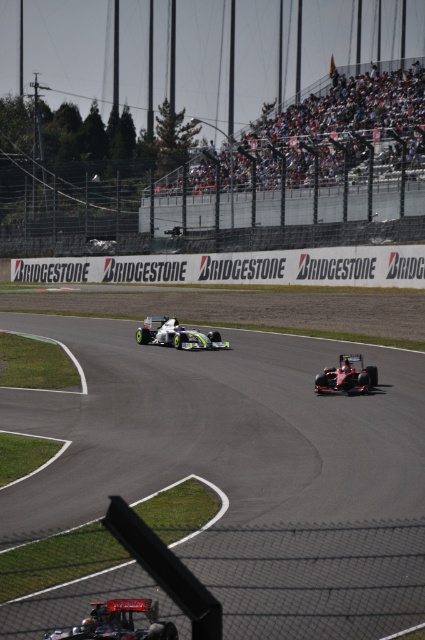
Looking at this image, which is more to the left, black rubber tire at lower center or black rubber tire at center?

black rubber tire at center is more to the left.

Is black rubber tire at lower center positioned in front of black rubber tire at center?

That is True.

Does point (374, 376) come farther from viewer compared to point (178, 336)?

No.

You are a GUI agent. You are given a task and a screenshot of the screen. Output one action in this format:
    pyautogui.click(x=<x>, y=<y>)
    Task: Click on the black rubber tire at lower center
    The image size is (425, 640).
    Given the screenshot: What is the action you would take?
    pyautogui.click(x=371, y=374)

Does point (116, 632) lie in front of point (138, 330)?

Yes, it is.

Who is positioned more to the left, shiny metallic race car at lower center or green rubber tire at center?

green rubber tire at center

What do you see at coordinates (119, 621) in the screenshot?
I see `shiny metallic race car at lower center` at bounding box center [119, 621].

Locate an element on the screen. The image size is (425, 640). shiny metallic race car at lower center is located at coordinates (119, 621).

Is green matte race car at center positioned in front of green rubber tire at center?

Yes, it is.

Can you confirm if green matte race car at center is thinner than green rubber tire at center?

No, green matte race car at center is not thinner than green rubber tire at center.

The width and height of the screenshot is (425, 640). In order to click on green matte race car at center in this screenshot , I will do `click(175, 332)`.